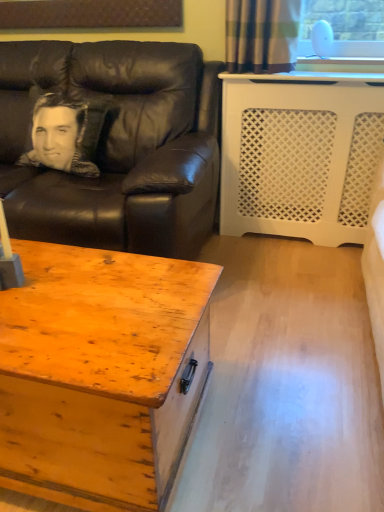
Question: Is black leather couch at left at the left side of silky black pillow at left?

Choices:
 (A) yes
 (B) no

Answer: (B)

Question: Is silky black pillow at left completely or partially inside black leather couch at left?

Choices:
 (A) no
 (B) yes

Answer: (B)

Question: Is black leather couch at left positioned behind silky black pillow at left?

Choices:
 (A) no
 (B) yes

Answer: (A)

Question: Does black leather couch at left have a larger size compared to silky black pillow at left?

Choices:
 (A) yes
 (B) no

Answer: (A)

Question: Is silky black pillow at left at the back of black leather couch at left?

Choices:
 (A) no
 (B) yes

Answer: (B)

Question: Considering the relative sizes of black leather couch at left and silky black pillow at left in the image provided, is black leather couch at left smaller than silky black pillow at left?

Choices:
 (A) yes
 (B) no

Answer: (B)

Question: Can we say wooden chest at lower left lies outside black leather couch at left?

Choices:
 (A) yes
 (B) no

Answer: (A)

Question: From a real-world perspective, is wooden chest at lower left located beneath black leather couch at left?

Choices:
 (A) yes
 (B) no

Answer: (A)

Question: Does wooden chest at lower left appear on the right side of black leather couch at left?

Choices:
 (A) yes
 (B) no

Answer: (A)

Question: Could you tell me if wooden chest at lower left is facing black leather couch at left?

Choices:
 (A) yes
 (B) no

Answer: (B)

Question: Is the surface of wooden chest at lower left in direct contact with black leather couch at left?

Choices:
 (A) yes
 (B) no

Answer: (B)

Question: Is black leather couch at left located within wooden chest at lower left?

Choices:
 (A) yes
 (B) no

Answer: (B)

Question: Does silky black pillow at left appear on the left side of black leather couch at left?

Choices:
 (A) yes
 (B) no

Answer: (A)